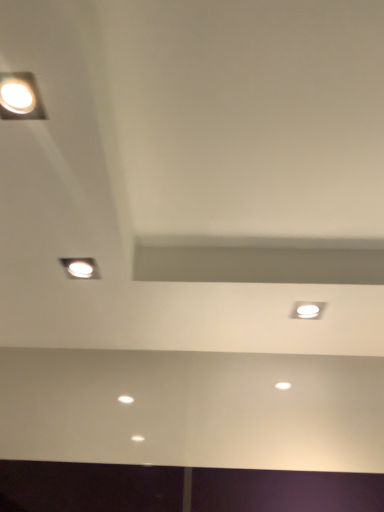
Question: Is matte silver lamp at upper left, which is the 2th lamp in front-to-back order, taller or shorter than matte white light fixture at upper left, the 1th lamp in the front-to-back sequence?

Choices:
 (A) tall
 (B) short

Answer: (A)

Question: In terms of size, does matte silver lamp at upper left, which is counted as the second lamp, starting from the top, appear bigger or smaller than matte white light fixture at upper left, the second lamp in the bottom-to-top sequence?

Choices:
 (A) big
 (B) small

Answer: (A)

Question: Which object is positioned closest to the matte silver lamp at upper left, which is counted as the second lamp, starting from the top?

Choices:
 (A) white glossy light fixture at upper right
 (B) matte white light fixture at upper left, which is the 1th lamp from top to bottom

Answer: (B)

Question: Which is nearer to the matte silver lamp at upper left, which is counted as the second lamp, starting from the top?

Choices:
 (A) matte white light fixture at upper left, the 1th lamp in the front-to-back sequence
 (B) white glossy light fixture at upper right

Answer: (A)